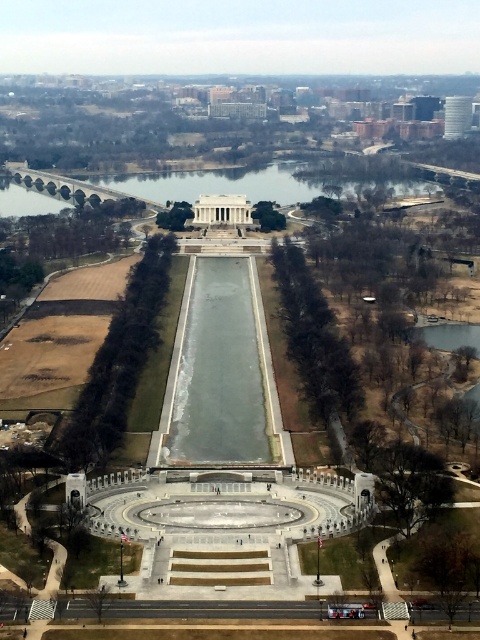
Question: Is clear glass waterway at center in front of white marble palace at center?

Choices:
 (A) no
 (B) yes

Answer: (B)

Question: From the image, what is the correct spatial relationship of clear glass waterway at center in relation to white marble palace at center?

Choices:
 (A) left
 (B) right

Answer: (B)

Question: Which object is the closest to the white marble palace at center?

Choices:
 (A) clear glass water at center
 (B) clear glass waterway at center

Answer: (B)

Question: Which point is farther to the camera?

Choices:
 (A) white marble palace at center
 (B) clear glass waterway at center
 (C) clear glass water at center

Answer: (C)

Question: In this image, where is clear glass water at center located relative to white marble palace at center?

Choices:
 (A) right
 (B) left

Answer: (A)

Question: Considering the real-world distances, which object is closest to the clear glass water at center?

Choices:
 (A) clear glass waterway at center
 (B) white marble palace at center

Answer: (B)